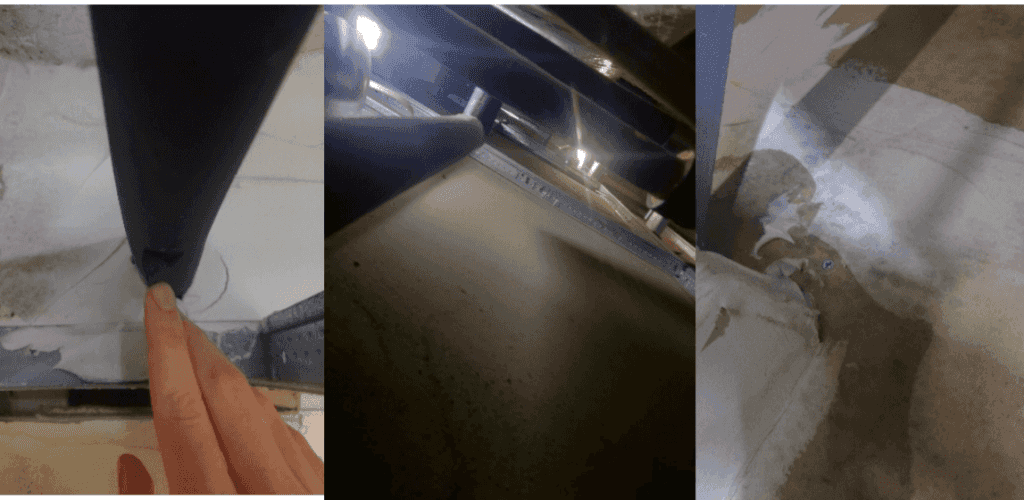
Where is `white paint`? The height and width of the screenshot is (500, 1024). white paint is located at coordinates (908, 176), (731, 387), (776, 214), (42, 220).